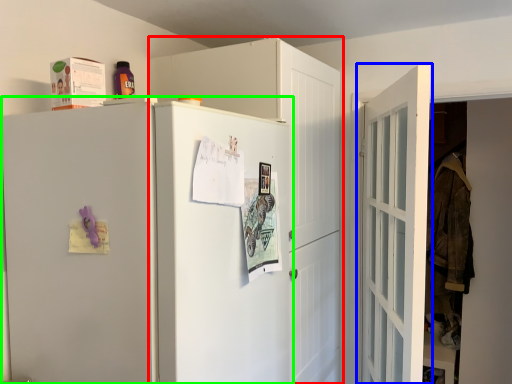
Question: Which object is the farthest from cabinetry (highlighted by a red box)? Choose among these: door (highlighted by a blue box) or refrigerator (highlighted by a green box).

Choices:
 (A) door
 (B) refrigerator

Answer: (A)